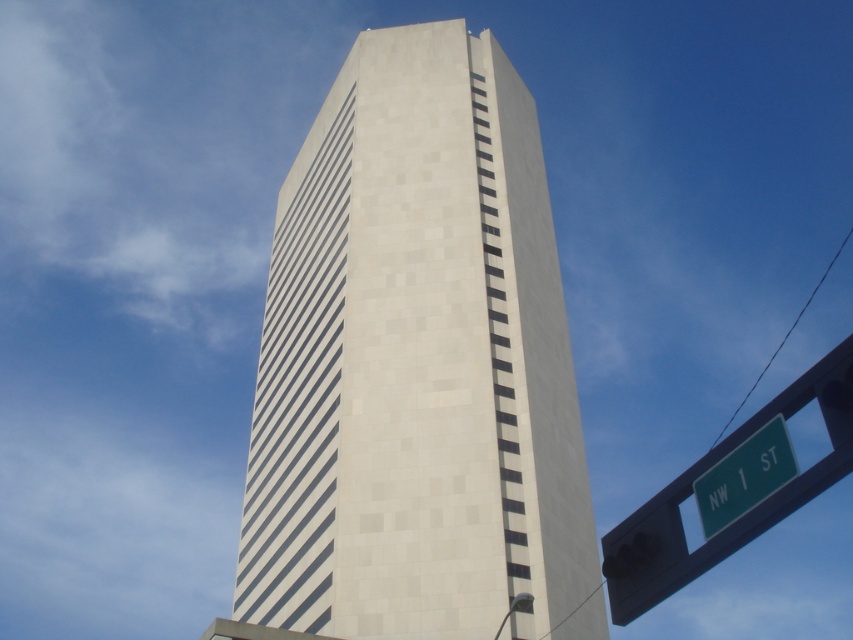
You are standing on the sidewalk in front of the white textured building at center. You want to see the green plastic street sign at lower right. Is the sign visible from your current position?

The green plastic street sign at lower right is behind the white textured building at center, so it is not visible from your current position in front of the building.

You are a city planner assessing the visibility of the green plastic street sign at lower right from the white textured building at center. Considering their relative widths, which object is wider?

The green plastic street sign at lower right is wider than the white textured building at center.

Based on the photo, you are standing at the entrance of the building and want to locate the white textured building at center. Based on its coordinates, where should you look relative to your position?

The white textured building at center is located at coordinates point (415, 362), which means it is slightly to the right and above your current position at the entrance.